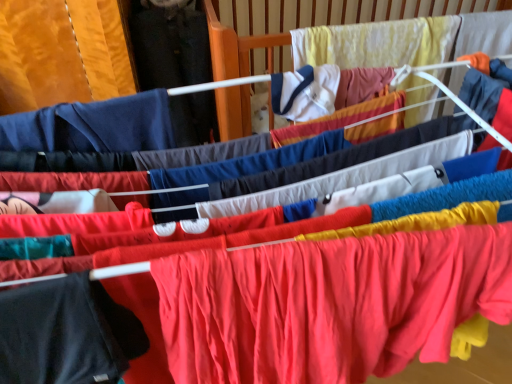
Question: Is yellow fabric infant bed at upper center wider than black matte t-shirt at lower left, acting as the first clothing starting from the left?

Choices:
 (A) no
 (B) yes

Answer: (A)

Question: Is yellow fabric infant bed at upper center oriented towards black matte t-shirt at lower left, positioned as the second clothing in right-to-left order?

Choices:
 (A) no
 (B) yes

Answer: (A)

Question: From a real-world perspective, is yellow fabric infant bed at upper center positioned over black matte t-shirt at lower left, positioned as the second clothing in right-to-left order, based on gravity?

Choices:
 (A) yes
 (B) no

Answer: (A)

Question: Can you confirm if yellow fabric infant bed at upper center is smaller than black matte t-shirt at lower left, acting as the first clothing starting from the left?

Choices:
 (A) no
 (B) yes

Answer: (A)

Question: Is yellow fabric infant bed at upper center facing away from black matte t-shirt at lower left, acting as the first clothing starting from the left?

Choices:
 (A) no
 (B) yes

Answer: (A)

Question: Does yellow fabric infant bed at upper center have a lesser height compared to black matte t-shirt at lower left, positioned as the second clothing in right-to-left order?

Choices:
 (A) no
 (B) yes

Answer: (A)

Question: From a real-world perspective, is black matte t-shirt at lower left, acting as the first clothing starting from the left, below yellow fabric infant bed at upper center?

Choices:
 (A) no
 (B) yes

Answer: (B)

Question: Does black matte t-shirt at lower left, acting as the first clothing starting from the left, have a greater height compared to yellow fabric infant bed at upper center?

Choices:
 (A) no
 (B) yes

Answer: (A)

Question: Can you confirm if black matte t-shirt at lower left, positioned as the second clothing in right-to-left order, is smaller than yellow fabric infant bed at upper center?

Choices:
 (A) no
 (B) yes

Answer: (B)

Question: From the image's perspective, is black matte t-shirt at lower left, positioned as the second clothing in right-to-left order, under yellow fabric infant bed at upper center?

Choices:
 (A) yes
 (B) no

Answer: (A)

Question: From the image's perspective, is black matte t-shirt at lower left, acting as the first clothing starting from the left, located above yellow fabric infant bed at upper center?

Choices:
 (A) no
 (B) yes

Answer: (A)

Question: Could you tell me if black matte t-shirt at lower left, acting as the first clothing starting from the left, is facing yellow fabric infant bed at upper center?

Choices:
 (A) yes
 (B) no

Answer: (B)

Question: Considering the relative sizes of matte red fabric at center, which is the 1th clothing from right to left, and black matte t-shirt at lower left, acting as the first clothing starting from the left, in the image provided, is matte red fabric at center, which is the 1th clothing from right to left, wider than black matte t-shirt at lower left, acting as the first clothing starting from the left,?

Choices:
 (A) no
 (B) yes

Answer: (B)